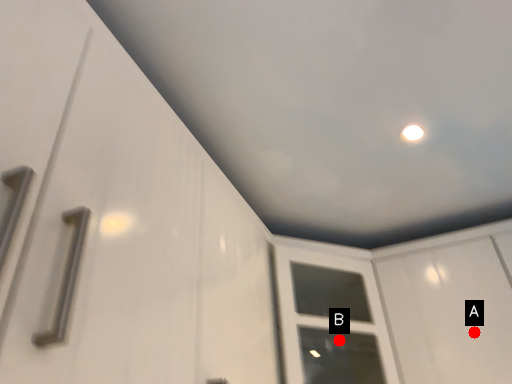
Question: Two points are circled on the image, labeled by A and B beside each circle. Which point appears farthest from the camera in this image?

Choices:
 (A) A is further
 (B) B is further

Answer: (B)